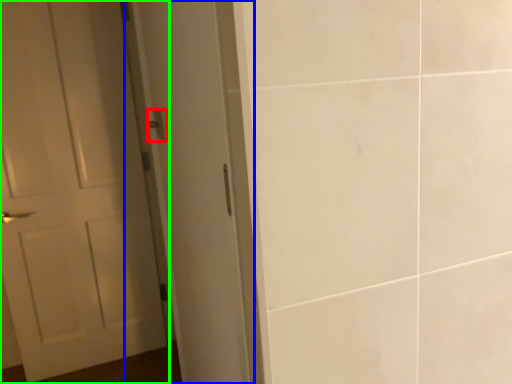
Question: Which object is positioned closest to door handle (highlighted by a red box)? Select from screen door (highlighted by a blue box) and door (highlighted by a green box).

Choices:
 (A) screen door
 (B) door

Answer: (A)